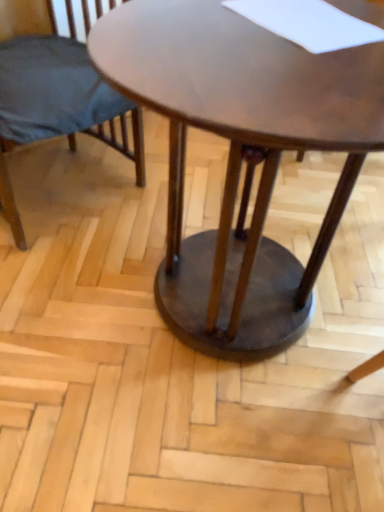
Find the location of a particular element. empty space that is ontop of shiny brown wood coffee table at center (from a real-world perspective) is located at coordinates (299, 48).